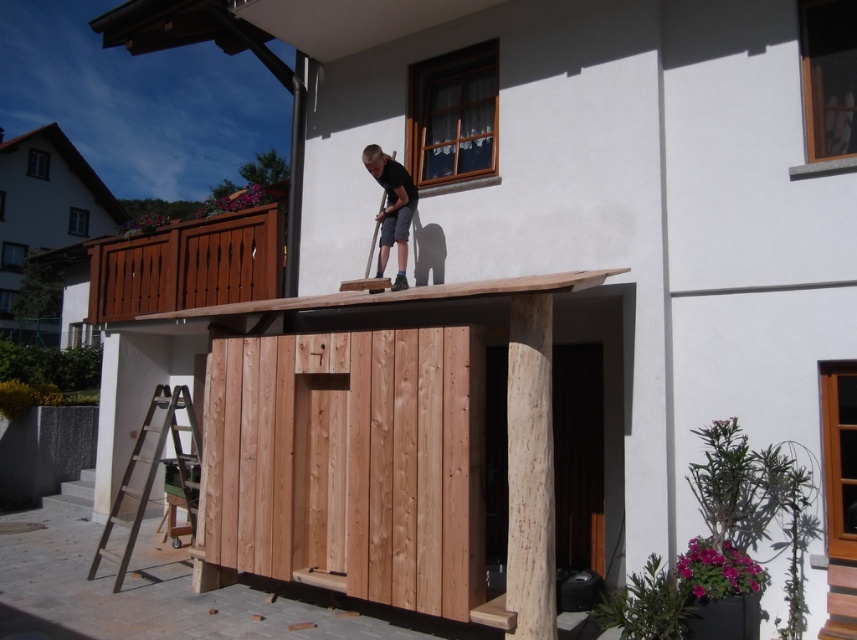
Question: Estimate the real-world distances between objects in this image. Which object is closer to the smooth reddish-brown wood at upper center?

Choices:
 (A) brown wooden hut at left
 (B) matte black shirt at upper center

Answer: (B)

Question: Does brown wooden hut at left have a smaller size compared to matte black shirt at upper center?

Choices:
 (A) yes
 (B) no

Answer: (B)

Question: Based on their relative distances, which object is nearer to the brown wooden ladder at lower left?

Choices:
 (A) brown wooden hut at left
 (B) matte black shirt at upper center

Answer: (B)

Question: Can you confirm if smooth reddish-brown wood at upper center is smaller than brown wooden ladder at lower left?

Choices:
 (A) no
 (B) yes

Answer: (A)

Question: Where is smooth reddish-brown wood at upper center located in relation to brown wooden ladder at lower left in the image?

Choices:
 (A) below
 (B) above

Answer: (B)

Question: Which object is positioned farthest from the brown wooden hut at left?

Choices:
 (A) brown wooden ladder at lower left
 (B) matte black shirt at upper center
 (C) smooth reddish-brown wood at upper center

Answer: (B)